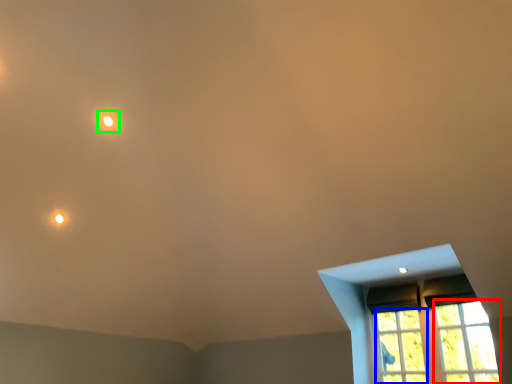
Question: Which object is the farthest from glass window (highlighted by a red box)? Choose among these: glass window (highlighted by a blue box) or light (highlighted by a green box).

Choices:
 (A) glass window
 (B) light

Answer: (B)